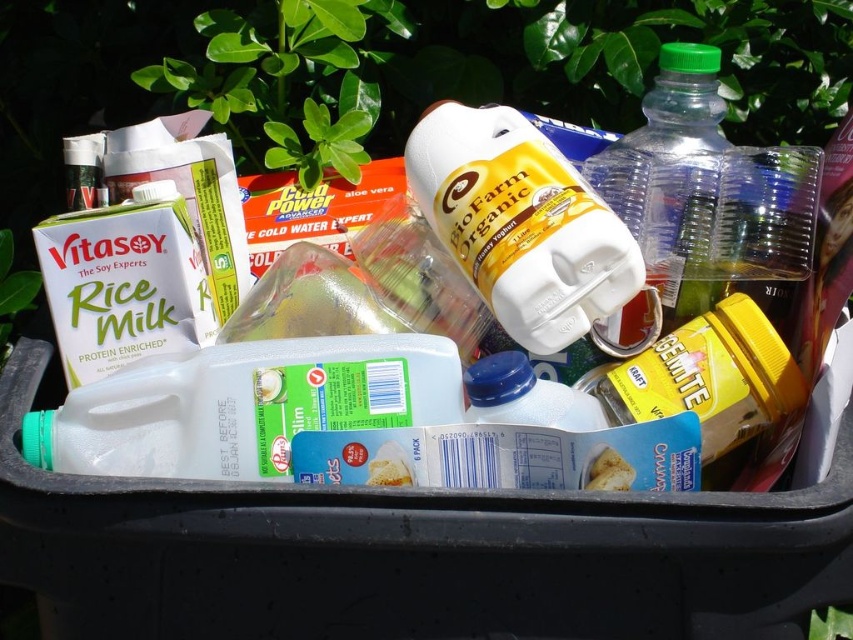
You are organizing items in the recycling bin and need to stack them vertically. The white plastic jug at center and the metallic silver can at upper left are both candidates. Based on their sizes, which one should you place at the bottom to ensure stability?

The white plastic jug at center has a greater height compared to the metallic silver can at upper left, so placing the taller jug at the bottom would provide a more stable base for stacking.

You are standing in front of the black recycling bin and want to pick up an item. You notice two points marked in the image. Which point, point (548, 344) or point (70, 177), is closer to you?

Point (548, 344) is closer to the camera than point (70, 177), so the point (548, 344) is closer to you.